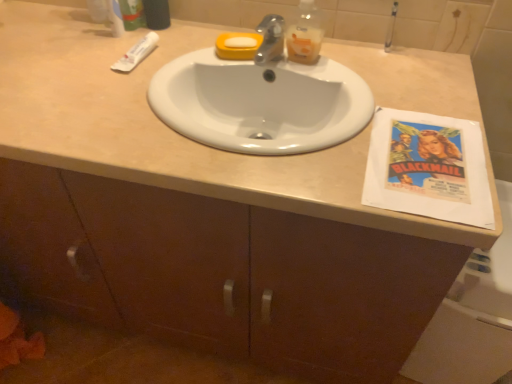
Find the location of a particular element. The width and height of the screenshot is (512, 384). free location to the left of white matte tube at upper left is located at coordinates (72, 54).